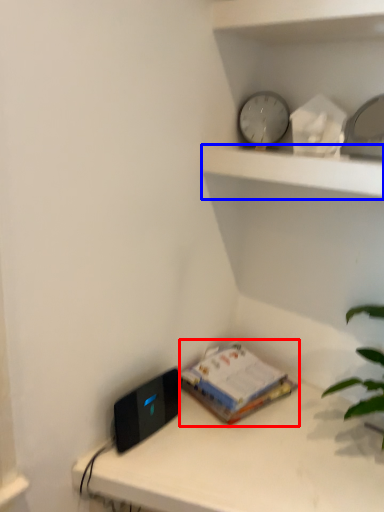
Question: Which object appears closest to the camera in this image, paperback book (highlighted by a red box) or shelf (highlighted by a blue box)?

Choices:
 (A) paperback book
 (B) shelf

Answer: (B)